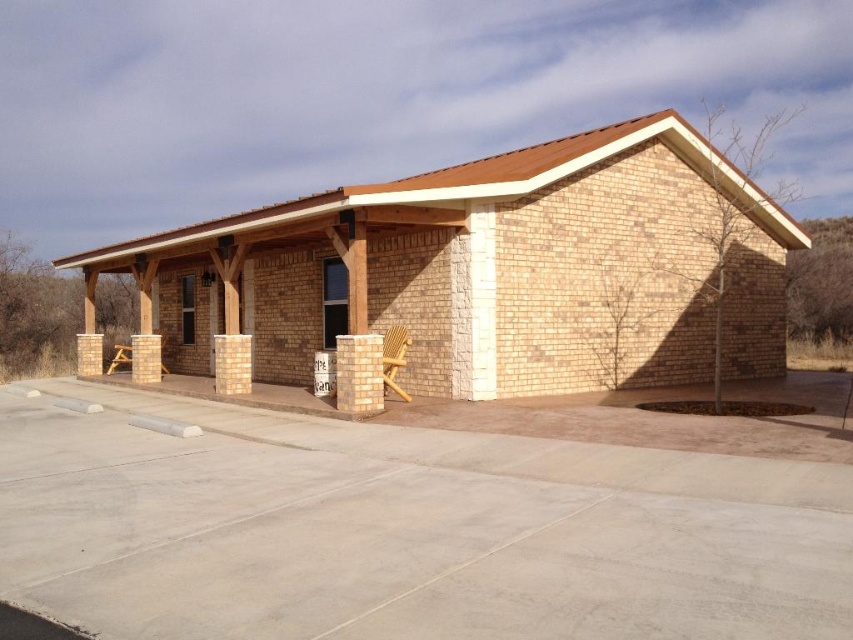
Between beige brick pillar at center and light brown wooden chair at center, which one has less height?

beige brick pillar at center

Between beige brick pillar at center and light brown wooden chair at center, which one is positioned lower?

beige brick pillar at center is below.

Where is `beige brick pillar at center`? The image size is (853, 640). beige brick pillar at center is located at coordinates (231, 364).

Locate an element on the screen. This screenshot has height=640, width=853. beige brick pillar at center is located at coordinates (231, 364).

Which is more to the right, light brown brick pillar at center or beige brick pillar at center?

Positioned to the right is light brown brick pillar at center.

Is point (340, 369) closer to camera compared to point (228, 355)?

Yes.

Identify the location of light brown brick pillar at center. The width and height of the screenshot is (853, 640). (358, 372).

How distant is light brown brick pillar at center from light brown wooden chair at center?

1.04 meters

Describe the element at coordinates (358, 372) in the screenshot. I see `light brown brick pillar at center` at that location.

I want to click on light brown brick pillar at center, so (358, 372).